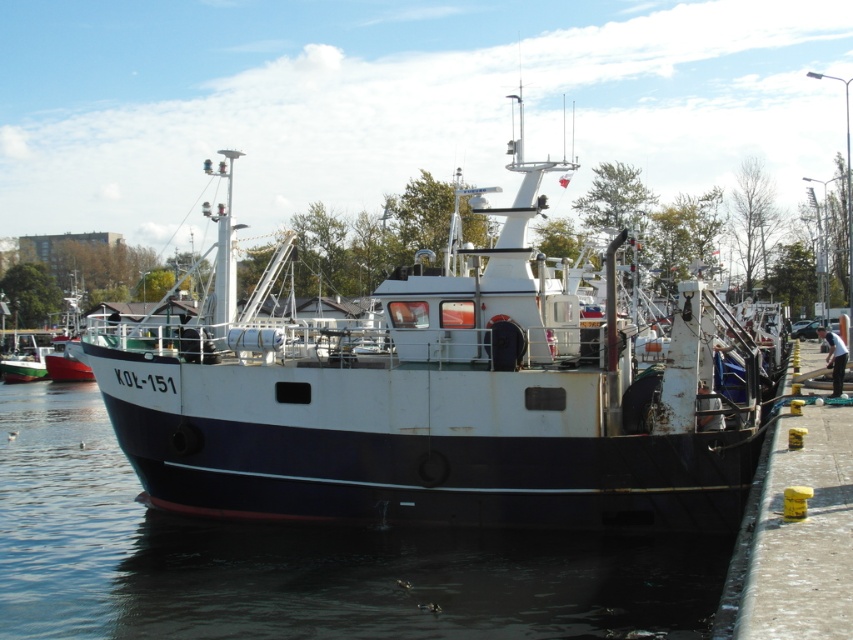
You are standing at the entrance of the marina and want to locate the white matte boat at center. According to the coordinates provided, where should you look in the image?

The white matte boat at center is located at the 2D coordinates point (445, 401) in the image.

You are a dock worker who needs to secure both the white matte boat at center and the white matte boat at left to the dock. Which boat requires a longer mooring line to accommodate its height?

The white matte boat at center requires a longer mooring line because it is much taller than the white matte boat at left.

You are standing on the dock and looking at the white matte boat at center and the white matte boat at left. Which boat is positioned higher relative to the other?

The white matte boat at center is located above the white matte boat at left, so it is positioned higher.